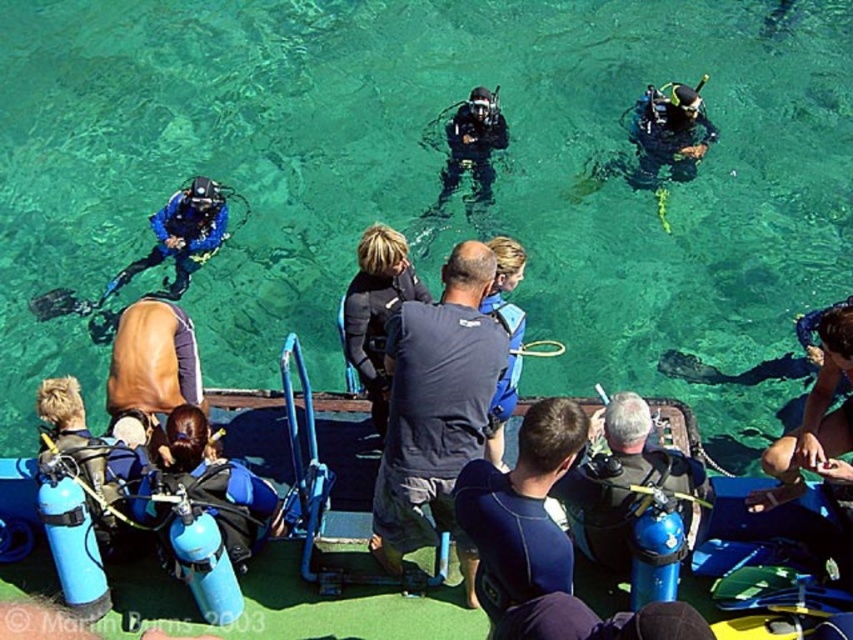
You are standing on the boat and want to jump into the clear water at lower center. Based on the coordinates provided, is the point marked by point (428, 177) the correct location to jump into the clear water at lower center?

Yes, the point (428, 177) marks the clear water at lower center, so jumping there would be correct.

You are a scuba diver preparing to dive from the boat. You notice the blue matte scuba tank at center and the blue rubber boat at lower center. Which object is positioned higher relative to the other?

The blue matte scuba tank at center is located above the blue rubber boat at lower center.

You are a scuba diver who needs to store your equipment. You have a blue matte scuba tank at center and a blue rubber boat at lower center available. Which object can you use to store your scuba tank?

The blue rubber boat at lower center is larger than the blue matte scuba tank at center, so you can store the scuba tank in the blue rubber boat at lower center.